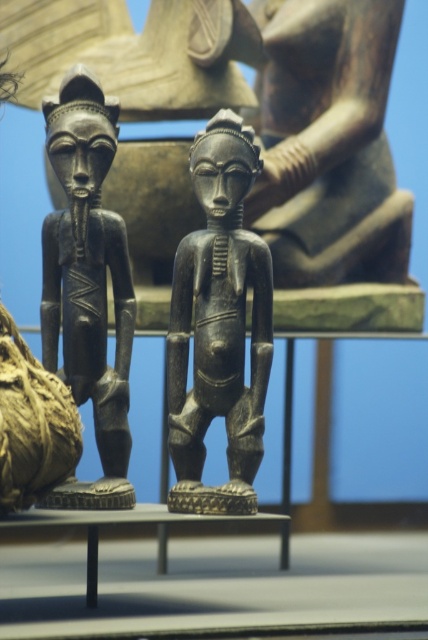
Question: Which is nearer to the black polished wood figure at center?

Choices:
 (A) black polished wood figurine at left
 (B) smooth dark wood figure at center

Answer: (A)

Question: Is black polished wood figure at center closer to camera compared to black polished wood figurine at left?

Choices:
 (A) yes
 (B) no

Answer: (A)

Question: Which of these objects is positioned farthest from the smooth dark wood figure at center?

Choices:
 (A) black polished wood figurine at left
 (B) black polished wood figure at center

Answer: (A)

Question: Does smooth dark wood figure at center have a lesser width compared to black polished wood figurine at left?

Choices:
 (A) yes
 (B) no

Answer: (B)

Question: Which point is farther to the camera?

Choices:
 (A) (130, 298)
 (B) (247, 433)

Answer: (A)

Question: Is smooth dark wood figure at center smaller than black polished wood figure at center?

Choices:
 (A) yes
 (B) no

Answer: (B)